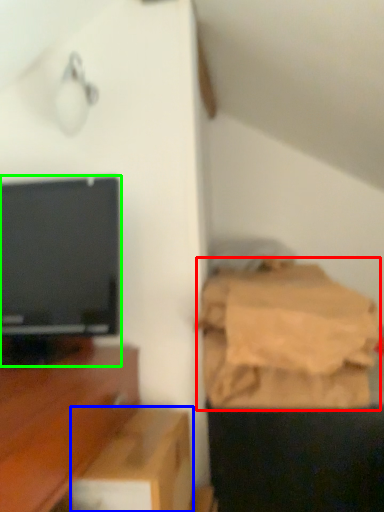
Question: Which object is the closest to the sheet (highlighted by a red box)? Choose among these: cardboard box (highlighted by a blue box) or television (highlighted by a green box).

Choices:
 (A) cardboard box
 (B) television

Answer: (A)